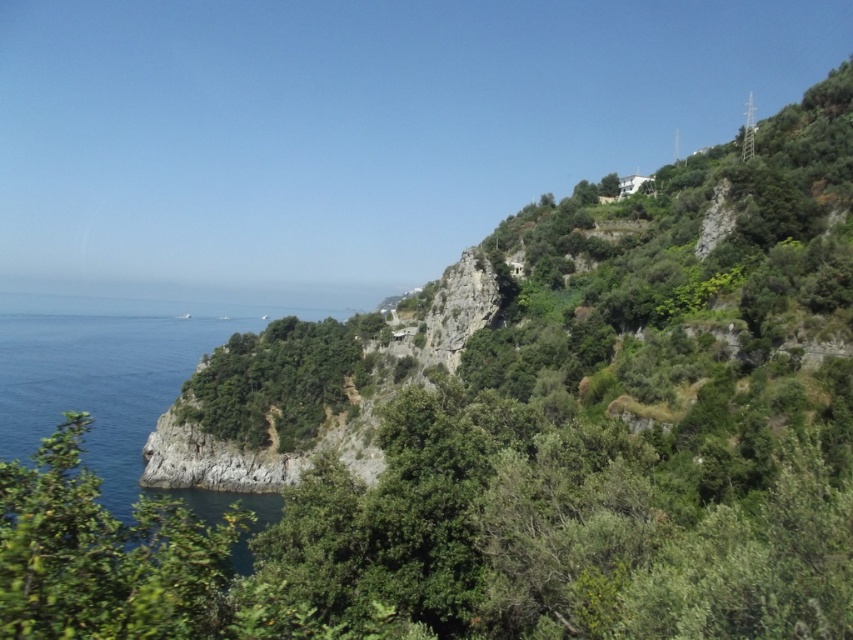
Question: In this image, where is blue water at lower left located relative to green leafy tree at lower left?

Choices:
 (A) below
 (B) above

Answer: (B)

Question: Which point is farther to the camera?

Choices:
 (A) (109, 451)
 (B) (334, 388)

Answer: (A)

Question: Does blue water at lower left have a smaller size compared to green leafy tree at lower left?

Choices:
 (A) yes
 (B) no

Answer: (B)

Question: Does blue water at lower left have a larger size compared to green leafy tree at lower left?

Choices:
 (A) yes
 (B) no

Answer: (A)